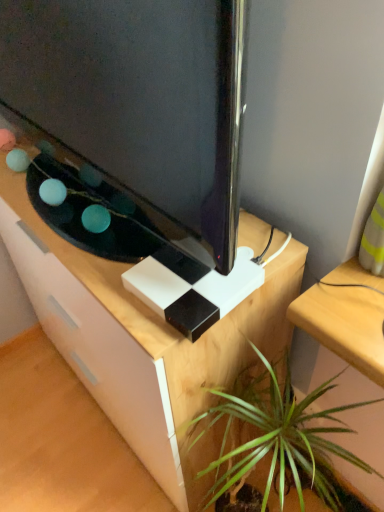
Question: Is matte black tv at center at the right side of white matte desk at center?

Choices:
 (A) yes
 (B) no

Answer: (B)

Question: Considering the relative sizes of matte black tv at center and white matte desk at center in the image provided, is matte black tv at center bigger than white matte desk at center?

Choices:
 (A) no
 (B) yes

Answer: (A)

Question: Is matte black tv at center closer to camera compared to white matte desk at center?

Choices:
 (A) yes
 (B) no

Answer: (A)

Question: Is matte black tv at center smaller than white matte desk at center?

Choices:
 (A) yes
 (B) no

Answer: (A)

Question: Can we say matte black tv at center lies outside white matte desk at center?

Choices:
 (A) yes
 (B) no

Answer: (A)

Question: Is matte black tv at center thinner than white matte desk at center?

Choices:
 (A) no
 (B) yes

Answer: (B)

Question: Is matte black tv at center oriented away from green leafy plant at lower center?

Choices:
 (A) yes
 (B) no

Answer: (B)

Question: Considering the relative sizes of matte black tv at center and green leafy plant at lower center in the image provided, is matte black tv at center taller than green leafy plant at lower center?

Choices:
 (A) yes
 (B) no

Answer: (B)

Question: Does matte black tv at center have a greater width compared to green leafy plant at lower center?

Choices:
 (A) yes
 (B) no

Answer: (B)

Question: Can you confirm if matte black tv at center is positioned to the left of green leafy plant at lower center?

Choices:
 (A) yes
 (B) no

Answer: (A)

Question: Does matte black tv at center have a lesser height compared to green leafy plant at lower center?

Choices:
 (A) no
 (B) yes

Answer: (B)

Question: Is matte black tv at center to the right of green leafy plant at lower center from the viewer's perspective?

Choices:
 (A) yes
 (B) no

Answer: (B)

Question: Is white matte desk at center aimed at green leafy plant at lower center?

Choices:
 (A) yes
 (B) no

Answer: (B)